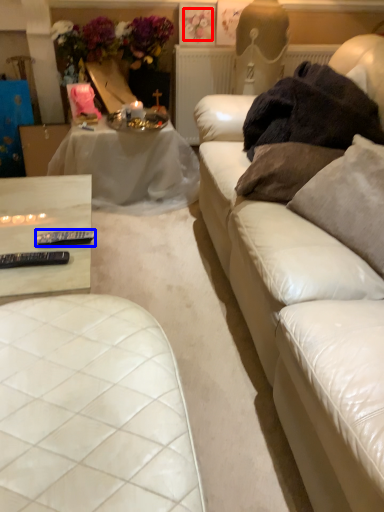
Question: Which of the following is the farthest to the observer, flower (highlighted by a red box) or tableware (highlighted by a blue box)?

Choices:
 (A) flower
 (B) tableware

Answer: (A)